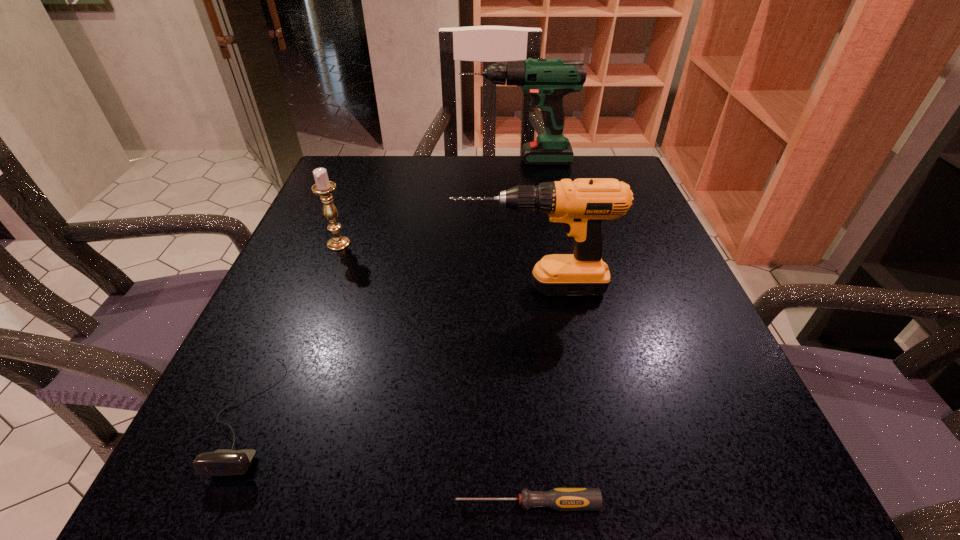
Locate an element on the screen. Image resolution: width=960 pixels, height=540 pixels. vacant area that lies between the fourth farthest object and the screwdriver is located at coordinates click(388, 458).

The height and width of the screenshot is (540, 960). I want to click on free space between the third farthest object and the webcam, so click(391, 350).

Image resolution: width=960 pixels, height=540 pixels. What are the coordinates of `object that is the fourth nearest to the candle holder` in the screenshot? It's located at (562, 499).

Point out which object is positioned as the fourth nearest to the third shortest object. Please provide its 2D coordinates. Your answer should be formatted as a tuple, i.e. [(x, y)], where the tuple contains the x and y coordinates of a point satisfying the conditions above.

[(562, 499)]

In order to click on free region that satisfies the following two spatial constraints: 1. at the tip of the third farthest object; 2. on the front-facing side of the webcam in this screenshot , I will do `click(548, 414)`.

At what (x,y) coordinates should I click in order to perform the action: click on vacant space that satisfies the following two spatial constraints: 1. at the tip of the third farthest object; 2. on the front-facing side of the fourth farthest object. Please return your answer as a coordinate pair (x, y). The width and height of the screenshot is (960, 540). Looking at the image, I should click on (548, 414).